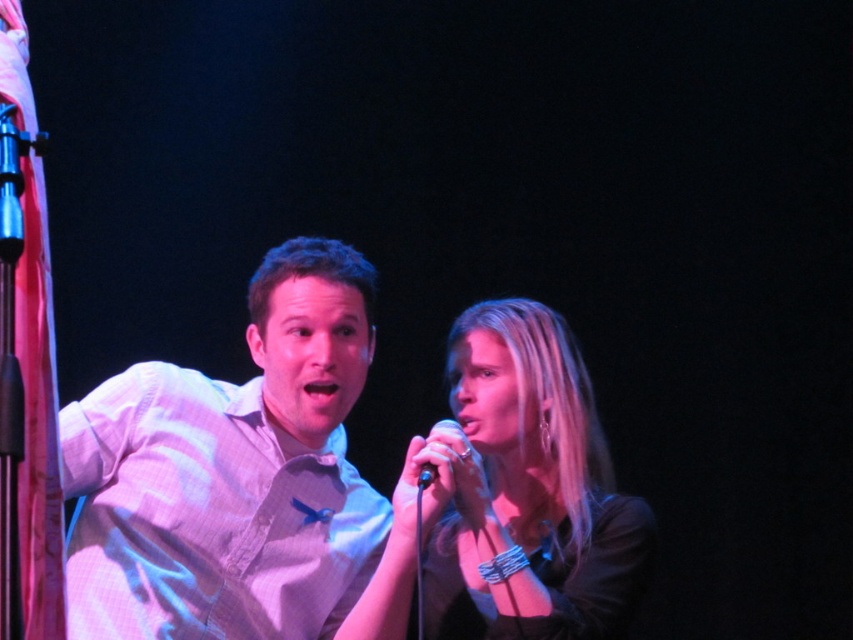
Question: Considering the relative positions of white checkered shirt at center and black metallic microphone at center in the image provided, where is white checkered shirt at center located with respect to black metallic microphone at center?

Choices:
 (A) left
 (B) right

Answer: (A)

Question: Considering the real-world distances, which object is closest to the white checkered shirt at center?

Choices:
 (A) black metallic microphone at center
 (B) smooth black shirt at center

Answer: (B)

Question: Among these points, which one is farthest from the camera?

Choices:
 (A) (447, 420)
 (B) (96, 612)
 (C) (463, 394)

Answer: (C)

Question: Is white checkered shirt at center in front of black metallic microphone at center?

Choices:
 (A) no
 (B) yes

Answer: (B)

Question: Among these objects, which one is farthest from the camera?

Choices:
 (A) white checkered shirt at center
 (B) smooth black shirt at center

Answer: (B)

Question: Is smooth black shirt at center positioned behind black metallic microphone at center?

Choices:
 (A) yes
 (B) no

Answer: (A)